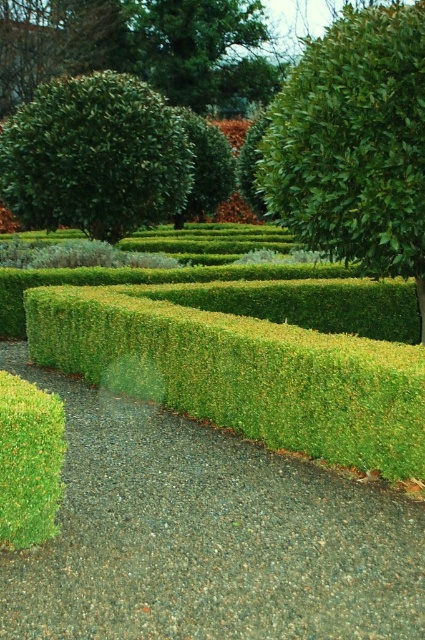
Which is more to the right, green leafy shrub at upper left or green fuzzy bush at center?

green fuzzy bush at center

Which is in front, point (181, 138) or point (20, 442)?

Point (20, 442) is more forward.

Is point (87, 150) farther from viewer compared to point (57, 461)?

Yes, point (87, 150) is behind point (57, 461).

This screenshot has width=425, height=640. I want to click on green leafy shrub at upper left, so click(95, 156).

Which is behind, point (328, 51) or point (40, 115)?

The point (40, 115) is more distant.

Does green leafy bush at upper right appear on the left side of green leafy shrub at upper left?

Incorrect, green leafy bush at upper right is not on the left side of green leafy shrub at upper left.

This screenshot has width=425, height=640. What do you see at coordinates (354, 144) in the screenshot?
I see `green leafy bush at upper right` at bounding box center [354, 144].

You are a GUI agent. You are given a task and a screenshot of the screen. Output one action in this format:
    pyautogui.click(x=<x>, y=<y>)
    Task: Click on the green leafy bush at upper right
    
    Given the screenshot: What is the action you would take?
    pyautogui.click(x=354, y=144)

Between green gravel at center and green fuzzy bush at center, which one has less height?

With less height is green gravel at center.

Who is more distant from viewer, [376,609] or [51,529]?

Point [51,529]

What are the coordinates of `green gravel at center` in the screenshot? It's located at (206, 536).